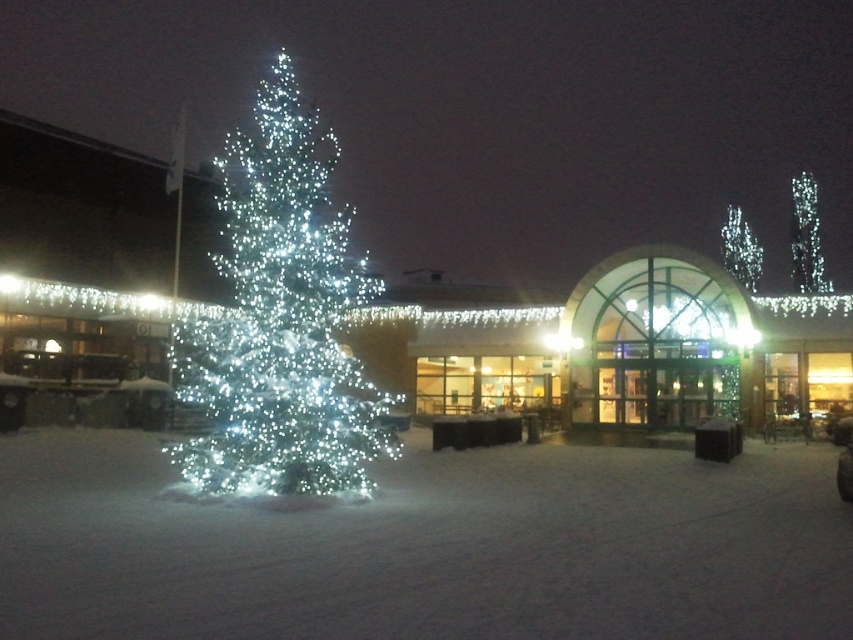
You are standing in front of the building and see the icy white lights at left and the icy white lights at center. Which set of lights is located to the left of the other?

The icy white lights at left is positioned on the left side of icy white lights at center.